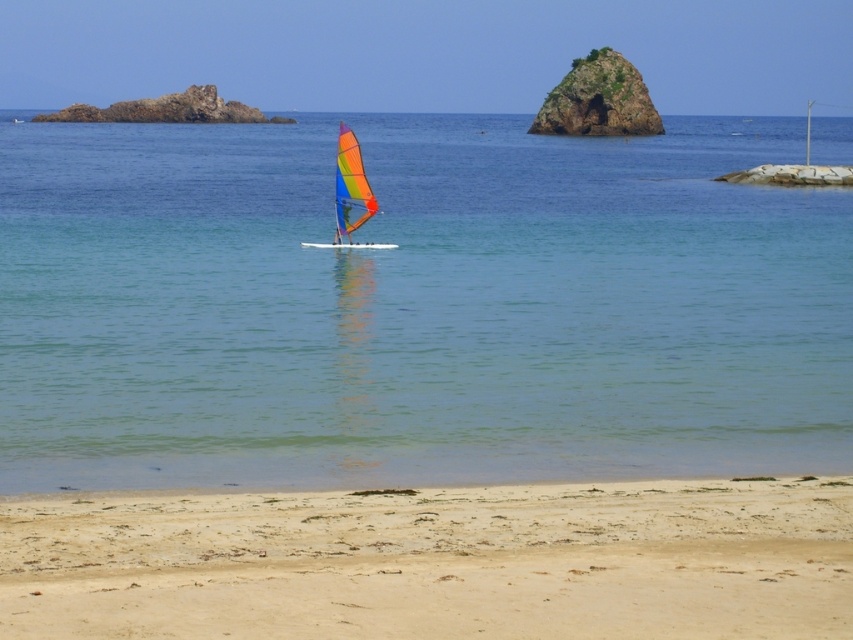
Can you confirm if clear blue water at center is shorter than beige sandy beach at lower center?

Incorrect, clear blue water at center's height does not fall short of beige sandy beach at lower center's.

Between clear blue water at center and beige sandy beach at lower center, which one is positioned higher?

clear blue water at center is higher up.

Is point (276, 144) positioned before point (413, 508)?

No, it is behind (413, 508).

Find the location of a particular element. The width and height of the screenshot is (853, 640). clear blue water at center is located at coordinates (416, 305).

This screenshot has height=640, width=853. I want to click on clear blue water at center, so click(x=416, y=305).

Is the position of clear blue water at center less distant than that of rainbow fabric sailboat at center?

Yes, it is.

Where is `clear blue water at center`? This screenshot has height=640, width=853. clear blue water at center is located at coordinates (416, 305).

Locate an element on the screen. The image size is (853, 640). clear blue water at center is located at coordinates (416, 305).

From the picture: Who is shorter, beige sandy beach at lower center or rainbow fabric sailboat at center?

beige sandy beach at lower center

Who is more forward, (88, 577) or (349, 186)?

→ Point (88, 577) is in front.

In order to click on beige sandy beach at lower center in this screenshot , I will do `click(434, 561)`.